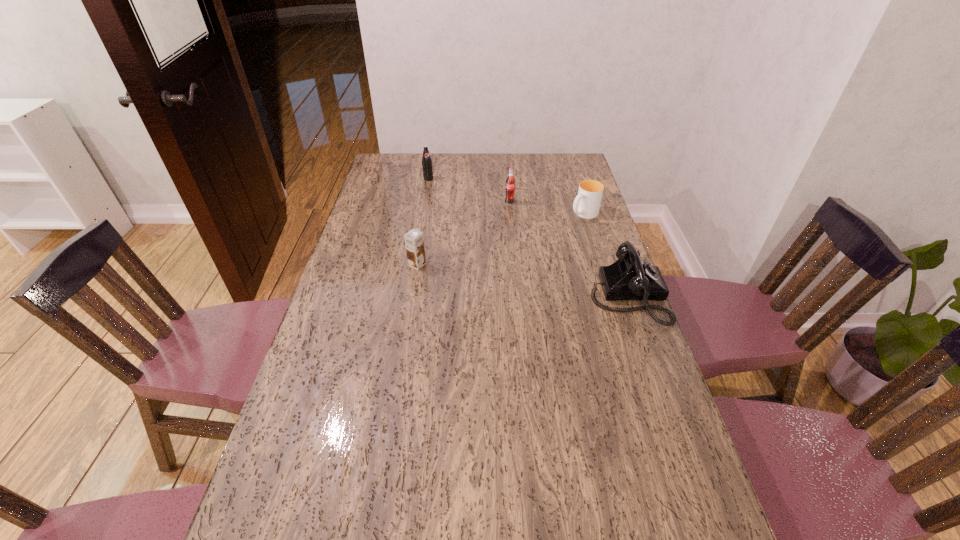
The width and height of the screenshot is (960, 540). Find the location of `vacant space that satisfies the following two spatial constraints: 1. on the front side of the telephone; 2. on the dial of the farthest object`. vacant space that satisfies the following two spatial constraints: 1. on the front side of the telephone; 2. on the dial of the farthest object is located at coordinates (408, 296).

Where is `vacant space that satisfies the following two spatial constraints: 1. on the front side of the telephone; 2. on the dial of the fourth nearest object`? The width and height of the screenshot is (960, 540). vacant space that satisfies the following two spatial constraints: 1. on the front side of the telephone; 2. on the dial of the fourth nearest object is located at coordinates (518, 296).

Where is `free spot that satisfies the following two spatial constraints: 1. on the front side of the telephone; 2. on the dial of the left pop`? The width and height of the screenshot is (960, 540). free spot that satisfies the following two spatial constraints: 1. on the front side of the telephone; 2. on the dial of the left pop is located at coordinates (408, 296).